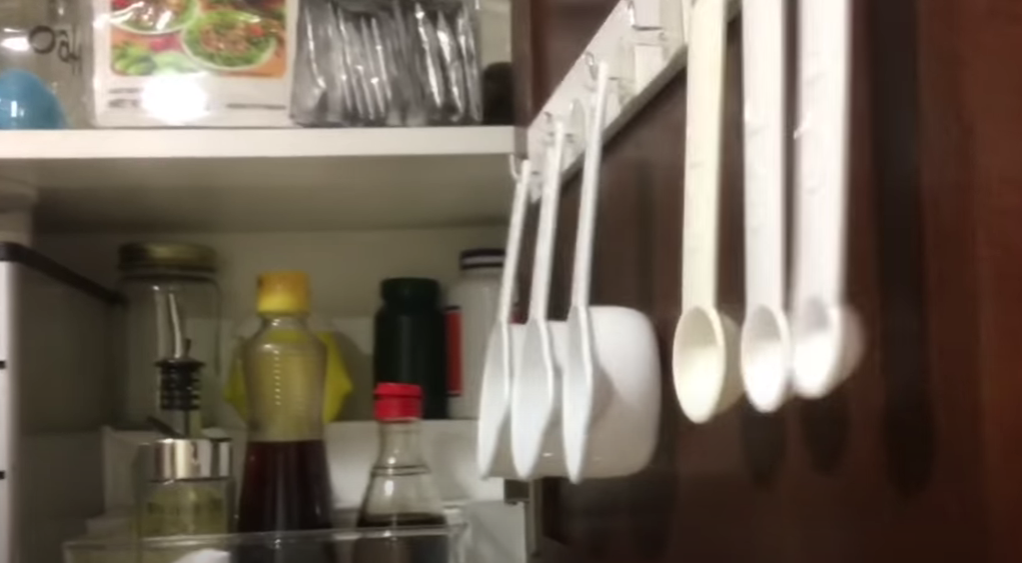
You are a GUI agent. You are given a task and a screenshot of the screen. Output one action in this format:
    pyautogui.click(x=<x>, y=<y>)
    Task: Click on the black jar
    The image size is (1022, 563).
    Given the screenshot: What is the action you would take?
    pyautogui.click(x=410, y=330)